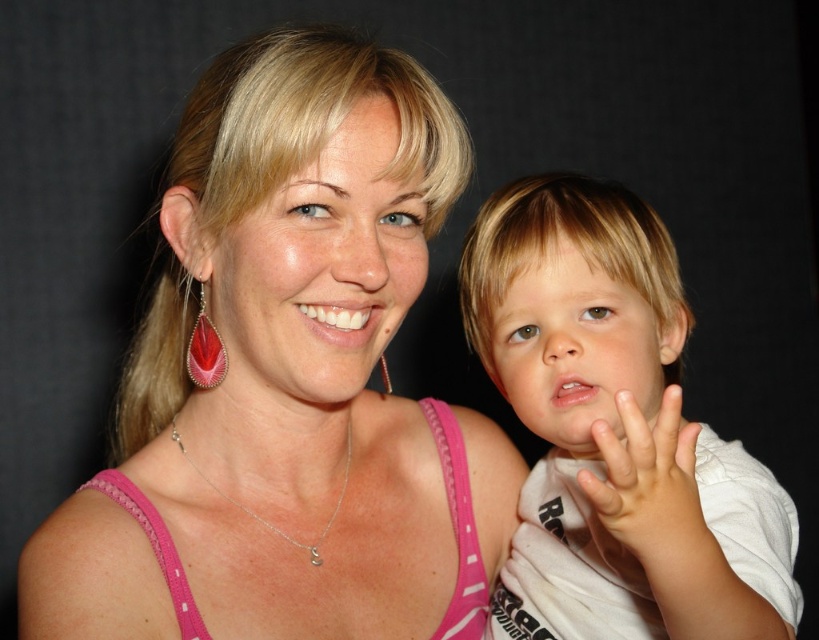
Can you confirm if pink fabric tank top at center is positioned above teardrop-shaped red gemstone earring at left?

No.

Who is higher up, pink fabric tank top at center or teardrop-shaped red gemstone earring at left?

teardrop-shaped red gemstone earring at left

Where is `pink fabric tank top at center`? This screenshot has width=819, height=640. pink fabric tank top at center is located at coordinates (288, 381).

Does pink fabric tank top at center have a greater width compared to white cotton shirt at right?

Yes.

Does pink fabric tank top at center have a larger size compared to white cotton shirt at right?

Yes.

Is point (467, 177) positioned behind point (501, 212)?

Yes, it is behind point (501, 212).

Find the location of a particular element. The width and height of the screenshot is (819, 640). pink fabric tank top at center is located at coordinates (288, 381).

Based on the photo, can you confirm if pale skin/soft flesh hand at center is positioned above teardrop-shaped red gemstone earring at left?

No, pale skin/soft flesh hand at center is not above teardrop-shaped red gemstone earring at left.

Is pale skin/soft flesh hand at center wider than teardrop-shaped red gemstone earring at left?

Correct, the width of pale skin/soft flesh hand at center exceeds that of teardrop-shaped red gemstone earring at left.

The height and width of the screenshot is (640, 819). Describe the element at coordinates (650, 490) in the screenshot. I see `pale skin/soft flesh hand at center` at that location.

Where is `pale skin/soft flesh hand at center`? pale skin/soft flesh hand at center is located at coordinates (650, 490).